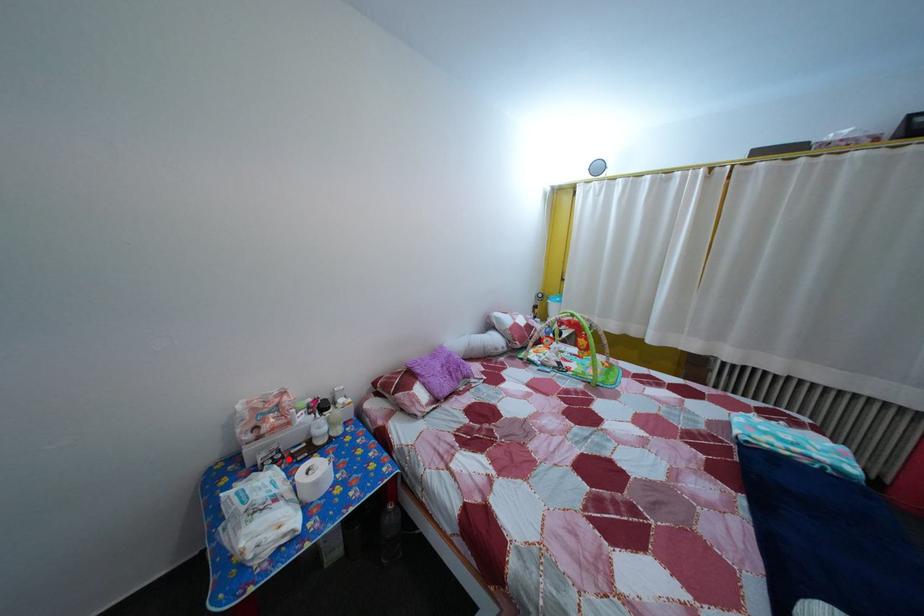
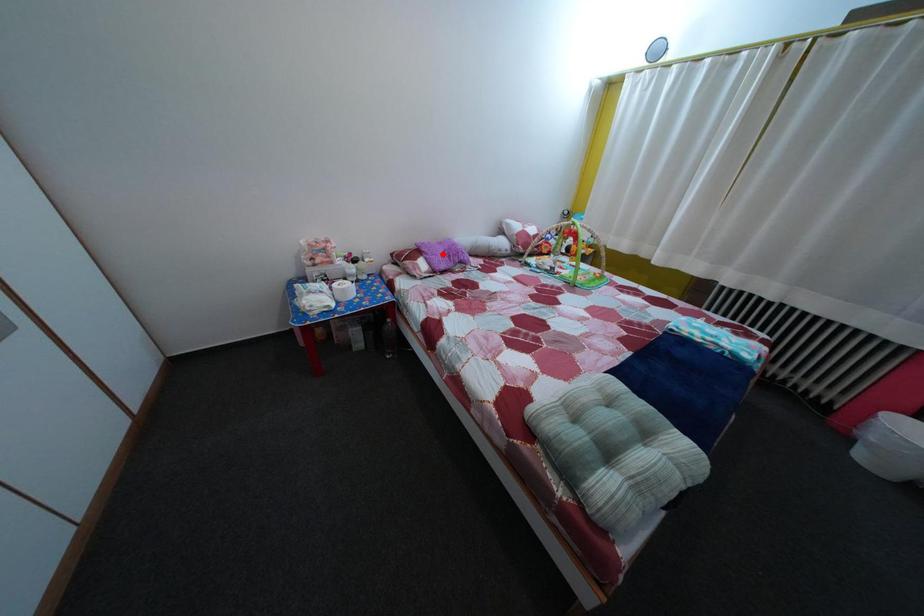
I am providing you with two images of the same scene from different viewpoints. A red point is marked on the first image and another point is marked on the second image. Are the points marked in image1 and image2 representing the same 3D position?

No